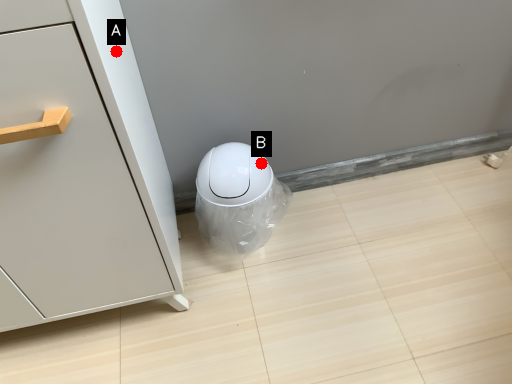
Question: Two points are circled on the image, labeled by A and B beside each circle. Which point is further to the camera?

Choices:
 (A) A is further
 (B) B is further

Answer: (B)